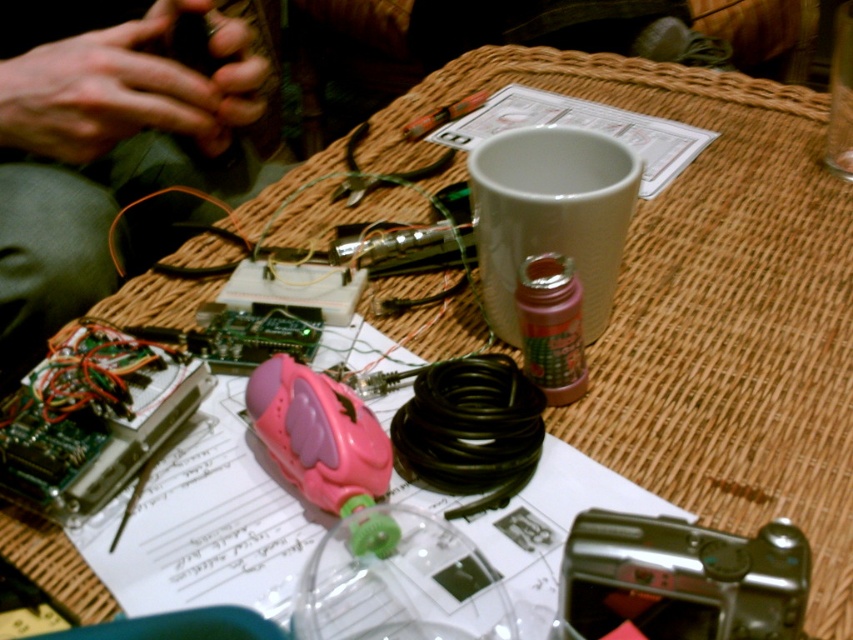
Does green fabric hands at upper left appear over black plastic camera at lower right?

Yes, green fabric hands at upper left is above black plastic camera at lower right.

Can you confirm if green fabric hands at upper left is smaller than black plastic camera at lower right?

No.

Is point (68, 227) positioned before point (631, 612)?

No.

Where is `green fabric hands at upper left`? This screenshot has height=640, width=853. green fabric hands at upper left is located at coordinates (106, 154).

Can you confirm if black plastic camera at lower right is taller than metallic silver tool at upper center?

Incorrect, black plastic camera at lower right's height is not larger of metallic silver tool at upper center's.

Which is more to the right, black plastic camera at lower right or metallic silver tool at upper center?

Positioned to the right is black plastic camera at lower right.

Who is more distant from viewer, (695, 570) or (410, 125)?

The point (410, 125) is behind.

I want to click on black plastic camera at lower right, so click(x=680, y=579).

Who is more distant from viewer, [764,538] or [527,433]?

Point [527,433]

Is black plastic camera at lower right thinner than black rubber wire at center?

Incorrect, black plastic camera at lower right's width is not less than black rubber wire at center's.

Does point (756, 561) come behind point (479, 387)?

No, (756, 561) is in front of (479, 387).

Image resolution: width=853 pixels, height=640 pixels. Identify the location of black plastic camera at lower right. (680, 579).